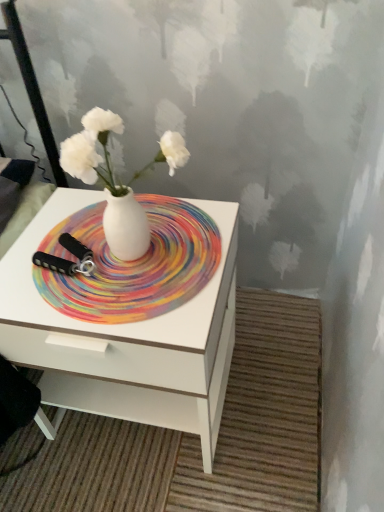
Locate an element on the screen. vacant space underneath rainbow swirl placemat at center (from a real-world perspective) is located at coordinates (149, 223).